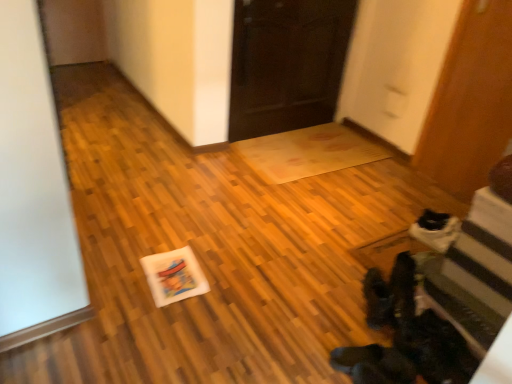
Where is `empty space that is ontop of white matte postcard at center (from a real-world perspective)`? The width and height of the screenshot is (512, 384). empty space that is ontop of white matte postcard at center (from a real-world perspective) is located at coordinates (175, 274).